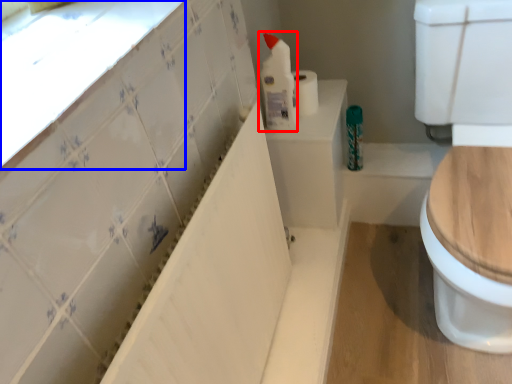
Question: Which object appears farthest to the camera in this image, cleaning product (highlighted by a red box) or window sill (highlighted by a blue box)?

Choices:
 (A) cleaning product
 (B) window sill

Answer: (A)